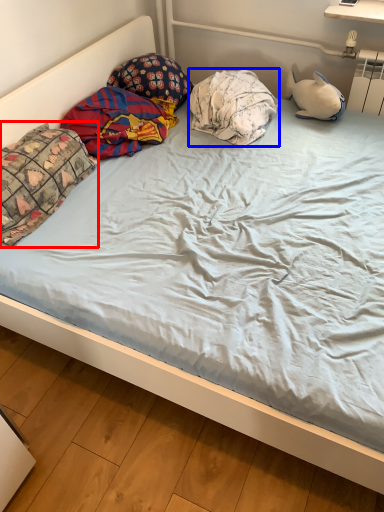
Question: Which of the following is the farthest to the observer, pillow (highlighted by a red box) or pillow (highlighted by a blue box)?

Choices:
 (A) pillow
 (B) pillow

Answer: (B)